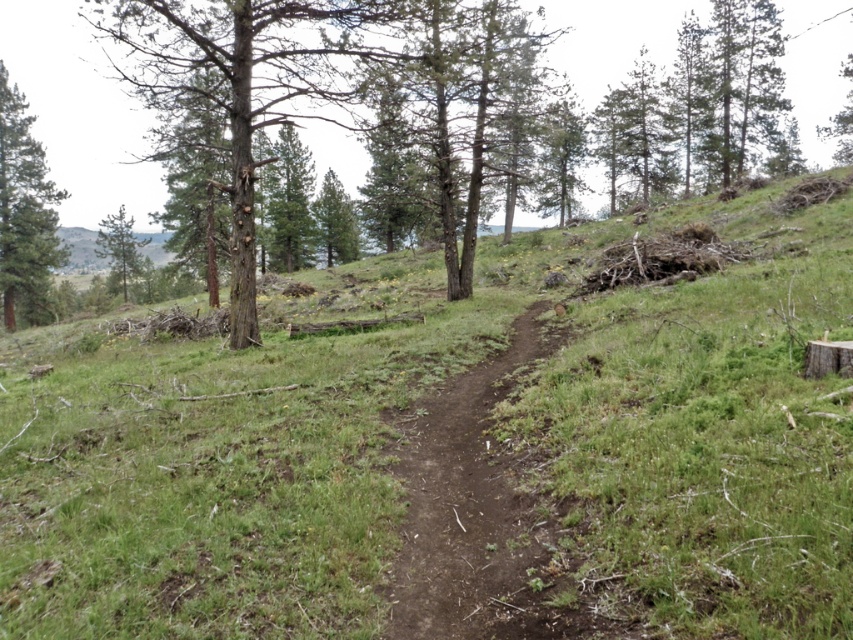
You are a hiker who wants to take a photo of the green grassy at center and the green matte tree at upper left. Which object should you focus on first if you want to capture both in the same frame without moving your camera?

You should focus on the green grassy at center first because it is located below the green matte tree at upper left, so adjusting the camera to include both would require ensuring the lower object is in frame before the upper one.

You are a hiker carrying a backpack and need to reach the green matte tree at upper left from the brown dirt track at center. Given that your backpack allows you to walk 250 feet before needing a rest, will you be able to reach the tree without stopping?

The brown dirt track at center and green matte tree at upper left are 244.37 feet apart from each other. Since 244.37 feet is less than 250 feet, you can reach the green matte tree at upper left without needing to stop for a rest.